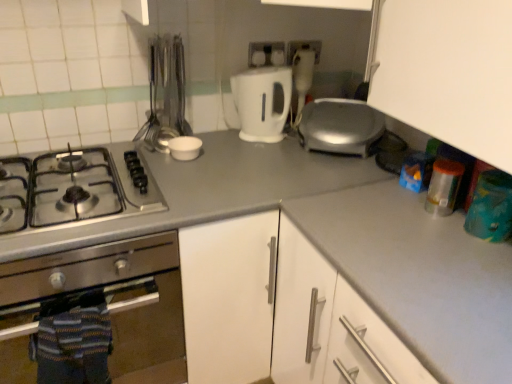
Where is `vacant space in front of white matte bowl at center`? This screenshot has width=512, height=384. vacant space in front of white matte bowl at center is located at coordinates (183, 172).